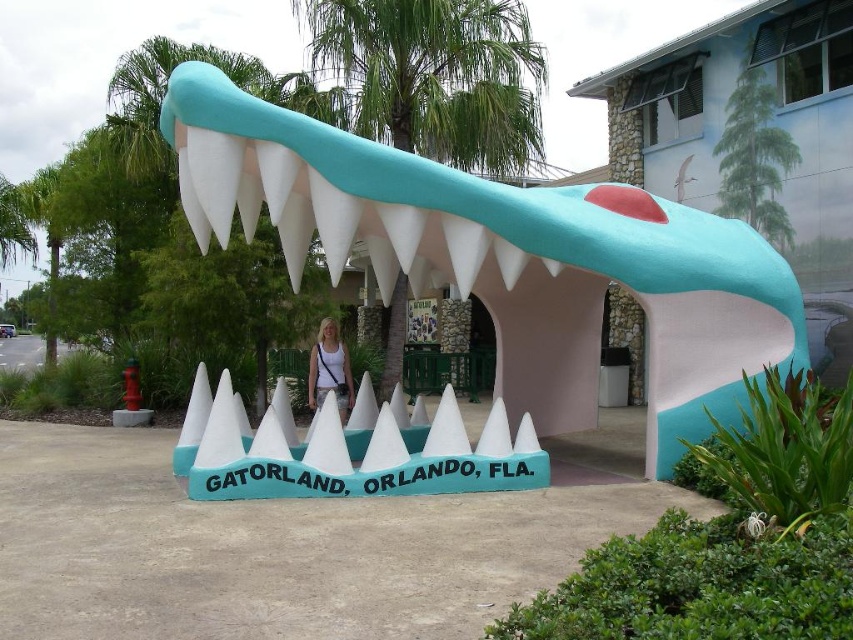
Measure the distance between green leafy palm tree at center and white fabric shirt at center.

green leafy palm tree at center and white fabric shirt at center are 4.69 meters apart.

Is green leafy palm tree at center below white fabric shirt at center?

Actually, green leafy palm tree at center is above white fabric shirt at center.

Is point (389, 320) farther from camera compared to point (340, 419)?

Yes, point (389, 320) is farther from viewer.

What are the coordinates of `green leafy palm tree at center` in the screenshot? It's located at (431, 76).

Consider the image. Can you confirm if matte blue sculpture at center is bigger than white fabric shirt at center?

Yes.

Between point (483, 259) and point (341, 422), which one is positioned behind?

The point (341, 422) is more distant.

You are a GUI agent. You are given a task and a screenshot of the screen. Output one action in this format:
    pyautogui.click(x=<x>, y=<y>)
    Task: Click on the matte blue sculpture at center
    This screenshot has height=640, width=853.
    Given the screenshot: What is the action you would take?
    pyautogui.click(x=502, y=257)

This screenshot has width=853, height=640. Find the location of `matte blue sculpture at center`. matte blue sculpture at center is located at coordinates (502, 257).

Is matte blue sculpture at center wider than green leafy palm tree at center?

No.

Can you confirm if matte blue sculpture at center is thinner than green leafy palm tree at center?

Yes, matte blue sculpture at center is thinner than green leafy palm tree at center.

Who is more forward, (300,173) or (328,28)?

Point (300,173) is in front.

Image resolution: width=853 pixels, height=640 pixels. I want to click on matte blue sculpture at center, so click(502, 257).